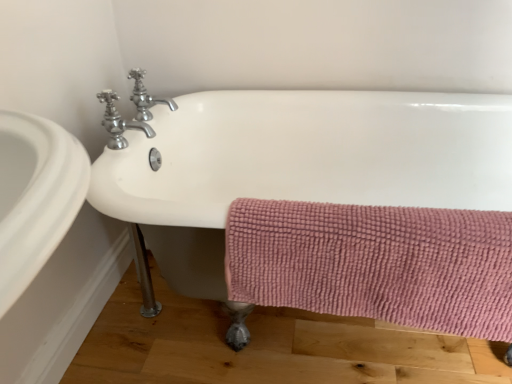
In order to face polished chrome faucet at upper left, the 1th tap when ordered from front to back, should I rotate leftwards or rightwards?

You should rotate left by 17.263 degrees.

What is the approximate height of polished chrome faucet at upper left, the 1th tap when ordered from front to back?

It is 6.12 inches.

At what (x,y) coordinates should I click in order to perform the action: click on pink textured towel at lower right. Please return your answer as a coordinate pair (x, y). Looking at the image, I should click on (375, 263).

Looking at this image, from the image's perspective, is polished chrome faucet at upper left, positioned as the 1th tap in back-to-front order, located above or below white ceramic bathtub at center?

polished chrome faucet at upper left, positioned as the 1th tap in back-to-front order, is situated higher than white ceramic bathtub at center in the image.

Can you confirm if polished chrome faucet at upper left, which is the 2th tap in front-to-back order, is taller than white ceramic bathtub at center?

No, polished chrome faucet at upper left, which is the 2th tap in front-to-back order, is not taller than white ceramic bathtub at center.

Is polished chrome faucet at upper left, positioned as the 1th tap in back-to-front order, inside the boundaries of white ceramic bathtub at center, or outside?

polished chrome faucet at upper left, positioned as the 1th tap in back-to-front order, is outside white ceramic bathtub at center.

Is polished chrome faucet at upper left, which is the 2th tap in front-to-back order, a part of pink textured towel at lower right?

No, polished chrome faucet at upper left, which is the 2th tap in front-to-back order, is not surrounded by pink textured towel at lower right.

Between pink textured towel at lower right and polished chrome faucet at upper left, which is the 2th tap in front-to-back order, which one has larger size?

pink textured towel at lower right is bigger.

From the picture: Are pink textured towel at lower right and polished chrome faucet at upper left, which is the 2th tap in front-to-back order, far apart?

No, pink textured towel at lower right is in close proximity to polished chrome faucet at upper left, which is the 2th tap in front-to-back order.

Considering the positions of objects pink textured towel at lower right and polished chrome faucet at upper left, positioned as the 1th tap in back-to-front order, in the image provided, who is behind, pink textured towel at lower right or polished chrome faucet at upper left, positioned as the 1th tap in back-to-front order,?

Positioned behind is polished chrome faucet at upper left, positioned as the 1th tap in back-to-front order.

Considering their positions, is pink textured towel at lower right located in front of or behind white ceramic bathtub at center?

In the image, pink textured towel at lower right appears behind white ceramic bathtub at center.

Could white ceramic bathtub at center be considered to be inside pink textured towel at lower right?

Definitely not — white ceramic bathtub at center is not inside pink textured towel at lower right.

Is pink textured towel at lower right positioned with its back to white ceramic bathtub at center?

Absolutely, pink textured towel at lower right is directed away from white ceramic bathtub at center.

Find the location of `bath towel that is on the right side of polished chrome faucet at upper left, the 1th tap when ordered from front to back`. bath towel that is on the right side of polished chrome faucet at upper left, the 1th tap when ordered from front to back is located at coordinates (375, 263).

Does polished chrome faucet at upper left, the 1th tap when ordered from front to back, have a greater width compared to pink textured towel at lower right?

Indeed, polished chrome faucet at upper left, the 1th tap when ordered from front to back, has a greater width compared to pink textured towel at lower right.

In the scene shown: Is pink textured towel at lower right completely or partially inside polished chrome faucet at upper left, which is counted as the 2th tap, starting from the back?

No, pink textured towel at lower right is not inside polished chrome faucet at upper left, which is counted as the 2th tap, starting from the back.

Considering the relative sizes of polished chrome faucet at upper left, which is counted as the 2th tap, starting from the back, and pink textured towel at lower right in the image provided, is polished chrome faucet at upper left, which is counted as the 2th tap, starting from the back, smaller than pink textured towel at lower right?

Correct, polished chrome faucet at upper left, which is counted as the 2th tap, starting from the back, occupies less space than pink textured towel at lower right.

I want to click on bathtub in front of the polished chrome faucet at upper left, positioned as the 1th tap in back-to-front order, so click(294, 163).

Measure the distance from white ceramic bathtub at center to polished chrome faucet at upper left, positioned as the 1th tap in back-to-front order.

white ceramic bathtub at center is 16.44 inches away from polished chrome faucet at upper left, positioned as the 1th tap in back-to-front order.

From the image's perspective, who appears lower, white ceramic bathtub at center or polished chrome faucet at upper left, which is the 2th tap in front-to-back order?

white ceramic bathtub at center is shown below in the image.

From the white ceramic bathtub at center, count 1st taps backward and point to it. Please provide its 2D coordinates.

[(137, 111)]

Who is taller, white ceramic bathtub at center or polished chrome faucet at upper left, the 1th tap when ordered from front to back?

white ceramic bathtub at center is taller.

Is white ceramic bathtub at center further to the viewer compared to polished chrome faucet at upper left, which is counted as the 2th tap, starting from the back?

No, white ceramic bathtub at center is closer to the camera.

Is polished chrome faucet at upper left, which is counted as the 2th tap, starting from the back, placed right next to white ceramic bathtub at center?

polished chrome faucet at upper left, which is counted as the 2th tap, starting from the back, and white ceramic bathtub at center are clearly separated.

There is a white ceramic bathtub at center. Where is `the 1st tap above it (from the image's perspective)`? The height and width of the screenshot is (384, 512). the 1st tap above it (from the image's perspective) is located at coordinates (137, 111).

How many degrees apart are the facing directions of polished chrome faucet at upper left, the 1th tap when ordered from front to back, and white ceramic bathtub at center?

polished chrome faucet at upper left, the 1th tap when ordered from front to back, and white ceramic bathtub at center are facing 87.8 degrees away from each other.

Is polished chrome faucet at upper left, which is counted as the 2th tap, starting from the back, inside or outside of white ceramic bathtub at center?

polished chrome faucet at upper left, which is counted as the 2th tap, starting from the back, cannot be found inside white ceramic bathtub at center.

Identify the location of the 2nd tap above when counting from the white ceramic bathtub at center (from the image's perspective). (145, 97).

Image resolution: width=512 pixels, height=384 pixels. Identify the location of the 1st tap counting from the left of the pink textured towel at lower right. (145, 97).

Which object lies nearer to the anchor point white ceramic bathtub at center, polished chrome faucet at upper left, which is counted as the 2th tap, starting from the back, or pink textured towel at lower right?

polished chrome faucet at upper left, which is counted as the 2th tap, starting from the back, is positioned closer to the anchor white ceramic bathtub at center.

Considering their positions, is pink textured towel at lower right positioned closer to polished chrome faucet at upper left, which is the 2th tap in front-to-back order, than white ceramic bathtub at center?

white ceramic bathtub at center.

When comparing their distances from polished chrome faucet at upper left, which is counted as the 2th tap, starting from the back, does white ceramic bathtub at center or pink textured towel at lower right seem further?

pink textured towel at lower right.

Which object lies further to the anchor point polished chrome faucet at upper left, which is counted as the 2th tap, starting from the back, pink textured towel at lower right or polished chrome faucet at upper left, which is the 2th tap in front-to-back order?

The object further to polished chrome faucet at upper left, which is counted as the 2th tap, starting from the back, is pink textured towel at lower right.

When comparing their distances from polished chrome faucet at upper left, which is the 2th tap in front-to-back order, does pink textured towel at lower right or polished chrome faucet at upper left, which is counted as the 2th tap, starting from the back, seem closer?

Among the two, polished chrome faucet at upper left, which is counted as the 2th tap, starting from the back, is located nearer to polished chrome faucet at upper left, which is the 2th tap in front-to-back order.

Which object lies nearer to the anchor point pink textured towel at lower right, white ceramic bathtub at center or polished chrome faucet at upper left, which is counted as the 2th tap, starting from the back?

The object closer to pink textured towel at lower right is white ceramic bathtub at center.

Based on the photo, which object lies nearer to the anchor point white ceramic bathtub at center, polished chrome faucet at upper left, which is the 2th tap in front-to-back order, or pink textured towel at lower right?

Based on the image, pink textured towel at lower right appears to be nearer to white ceramic bathtub at center.

From the image, which object appears to be farther from pink textured towel at lower right, polished chrome faucet at upper left, positioned as the 1th tap in back-to-front order, or white ceramic bathtub at center?

polished chrome faucet at upper left, positioned as the 1th tap in back-to-front order, is further to pink textured towel at lower right.

In order to click on bath towel between polished chrome faucet at upper left, positioned as the 1th tap in back-to-front order, and white ceramic bathtub at center, in the horizontal direction in this screenshot , I will do `click(375, 263)`.

This screenshot has width=512, height=384. I want to click on bath towel situated between polished chrome faucet at upper left, which is counted as the 2th tap, starting from the back, and white ceramic bathtub at center from left to right, so click(x=375, y=263).

Identify the location of tap between polished chrome faucet at upper left, which is counted as the 2th tap, starting from the back, and white ceramic bathtub at center from left to right. (145, 97).

Identify the location of tap situated between polished chrome faucet at upper left, which is counted as the 2th tap, starting from the back, and pink textured towel at lower right from left to right. This screenshot has width=512, height=384. (145, 97).